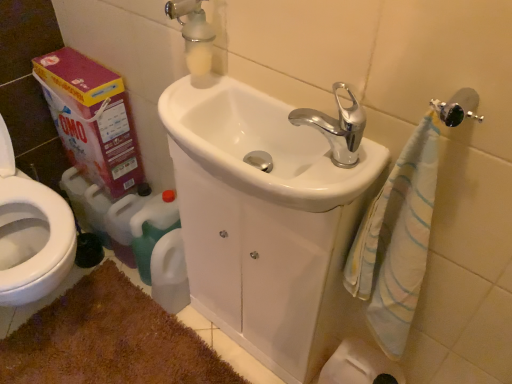
Question: Is white glossy sink at center wider than chrome metallic faucet at upper center?

Choices:
 (A) no
 (B) yes

Answer: (B)

Question: From the image's perspective, is white glossy sink at center beneath chrome metallic faucet at upper center?

Choices:
 (A) yes
 (B) no

Answer: (A)

Question: From a real-world perspective, is white glossy sink at center on top of chrome metallic faucet at upper center?

Choices:
 (A) yes
 (B) no

Answer: (B)

Question: Is white glossy sink at center at the right side of chrome metallic faucet at upper center?

Choices:
 (A) no
 (B) yes

Answer: (A)

Question: Is white glossy sink at center surrounding chrome metallic faucet at upper center?

Choices:
 (A) no
 (B) yes

Answer: (A)

Question: Is white glossy sink at center facing away from chrome metallic faucet at upper center?

Choices:
 (A) no
 (B) yes

Answer: (A)

Question: Is chrome metallic faucet at upper center placed right next to white frosted glass soap dispenser at upper center?

Choices:
 (A) yes
 (B) no

Answer: (B)

Question: Considering the relative positions of chrome metallic faucet at upper center and white frosted glass soap dispenser at upper center in the image provided, is chrome metallic faucet at upper center to the left of white frosted glass soap dispenser at upper center from the viewer's perspective?

Choices:
 (A) no
 (B) yes

Answer: (A)

Question: From a real-world perspective, is chrome metallic faucet at upper center below white frosted glass soap dispenser at upper center?

Choices:
 (A) yes
 (B) no

Answer: (A)

Question: Is chrome metallic faucet at upper center smaller than white frosted glass soap dispenser at upper center?

Choices:
 (A) no
 (B) yes

Answer: (B)

Question: Is chrome metallic faucet at upper center shorter than white frosted glass soap dispenser at upper center?

Choices:
 (A) no
 (B) yes

Answer: (B)

Question: Does chrome metallic faucet at upper center have a larger size compared to white frosted glass soap dispenser at upper center?

Choices:
 (A) yes
 (B) no

Answer: (B)

Question: Can you confirm if white glossy sink at center is taller than white frosted glass soap dispenser at upper center?

Choices:
 (A) no
 (B) yes

Answer: (A)